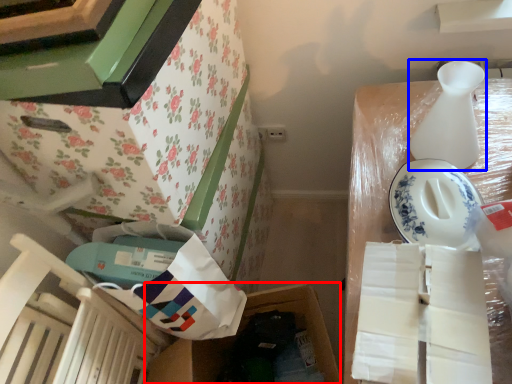
Question: Which object is closer to the camera taking this photo, storage box (highlighted by a red box) or vase (highlighted by a blue box)?

Choices:
 (A) storage box
 (B) vase

Answer: (B)